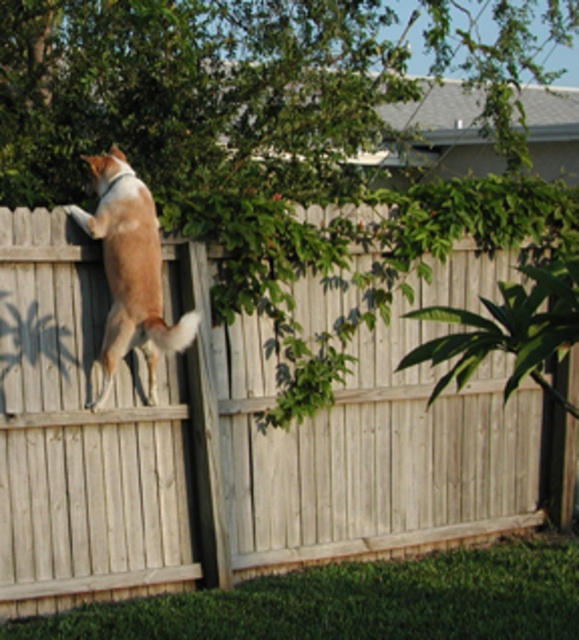
Question: Which point is closer to the camera?

Choices:
 (A) (97, 173)
 (B) (223, 403)

Answer: (B)

Question: Among these objects, which one is farthest from the camera?

Choices:
 (A) light brown wooden fence at upper left
 (B) brown furry dog at upper center

Answer: (A)

Question: Is light brown wooden fence at upper left thinner than brown furry dog at upper center?

Choices:
 (A) no
 (B) yes

Answer: (A)

Question: Is light brown wooden fence at upper left further to the viewer compared to brown furry dog at upper center?

Choices:
 (A) no
 (B) yes

Answer: (B)

Question: Can you confirm if light brown wooden fence at upper left is positioned below brown furry dog at upper center?

Choices:
 (A) no
 (B) yes

Answer: (B)